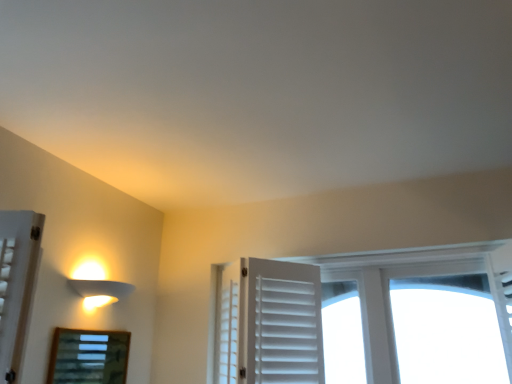
Question: From the image's perspective, is matte white lamp at left below wooden framed mirror at lower left?

Choices:
 (A) no
 (B) yes

Answer: (A)

Question: Is matte white lamp at left positioned far away from wooden framed mirror at lower left?

Choices:
 (A) no
 (B) yes

Answer: (A)

Question: Is matte white lamp at left closer to camera compared to wooden framed mirror at lower left?

Choices:
 (A) no
 (B) yes

Answer: (A)

Question: From a real-world perspective, is matte white lamp at left positioned under wooden framed mirror at lower left based on gravity?

Choices:
 (A) no
 (B) yes

Answer: (A)

Question: Could wooden framed mirror at lower left be considered to be inside matte white lamp at left?

Choices:
 (A) no
 (B) yes

Answer: (A)

Question: Is matte white lamp at left smaller than wooden framed mirror at lower left?

Choices:
 (A) no
 (B) yes

Answer: (A)

Question: Can you confirm if wooden framed mirror at lower left is shorter than matte white lamp at left?

Choices:
 (A) yes
 (B) no

Answer: (B)

Question: Is wooden framed mirror at lower left bigger than matte white lamp at left?

Choices:
 (A) no
 (B) yes

Answer: (A)

Question: Considering the relative positions of wooden framed mirror at lower left and matte white lamp at left in the image provided, is wooden framed mirror at lower left to the right of matte white lamp at left from the viewer's perspective?

Choices:
 (A) yes
 (B) no

Answer: (B)

Question: Is wooden framed mirror at lower left positioned in front of matte white lamp at left?

Choices:
 (A) no
 (B) yes

Answer: (B)

Question: From the image's perspective, is wooden framed mirror at lower left over matte white lamp at left?

Choices:
 (A) no
 (B) yes

Answer: (A)

Question: Does wooden framed mirror at lower left have a greater height compared to matte white lamp at left?

Choices:
 (A) yes
 (B) no

Answer: (A)

Question: From the image's perspective, is wooden framed mirror at lower left positioned above or below matte white lamp at left?

Choices:
 (A) below
 (B) above

Answer: (A)